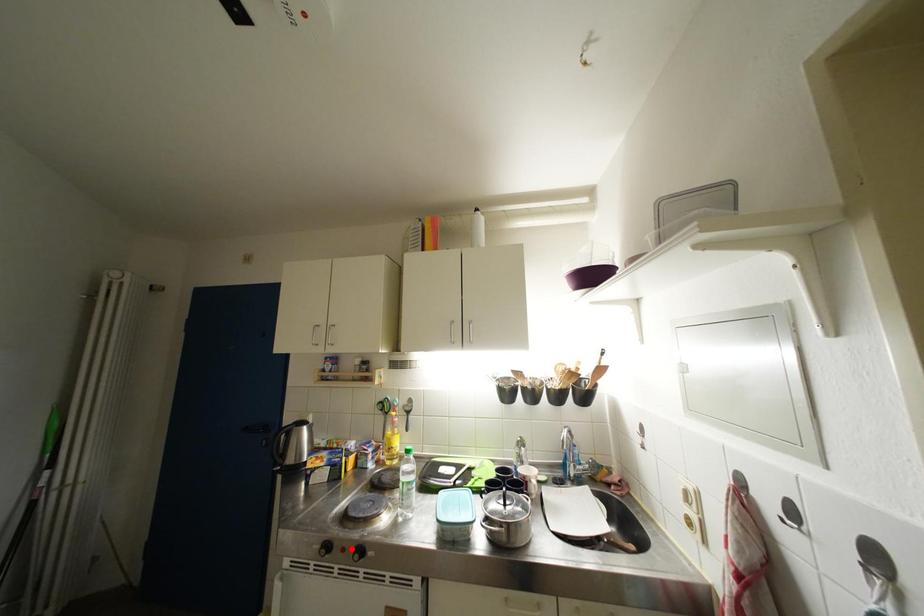
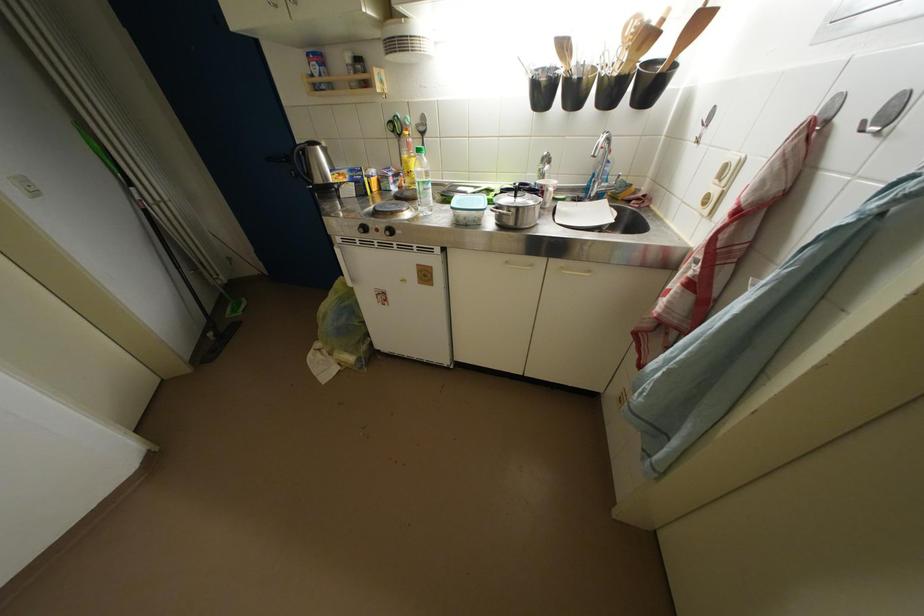
Question: I am providing you with two images of the same scene from different viewpoints. Given a red point in image1, look at the same physical point in image2. Is it:

Choices:
 (A) Closer to the viewpoint
 (B) Farther from the viewpoint

Answer: (A)